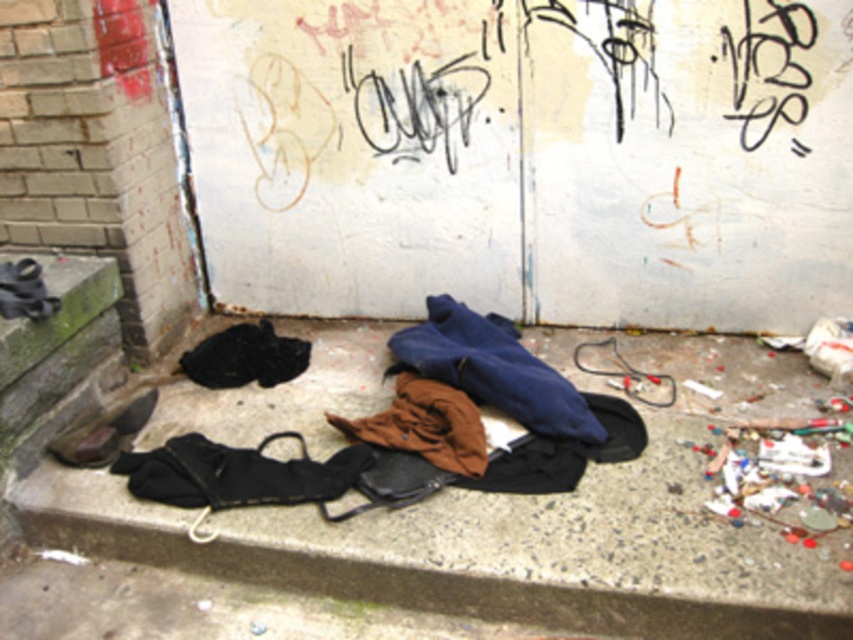
You are standing in the alley and want to pick up two items. One is at point [399,330] and the other at point [120,449]. Which item should you reach for first to minimize walking distance?

You should reach for the item at point [399,330] first because it is closer to you than the item at point [120,449].

You are standing in the middle of the scene. There is a point at coordinates (492, 369). Which object is this point located on?

The point at coordinates (492, 369) is located on the blue cotton hoodie at center.

You are a street cleaner assigned to pick up the blue cotton hoodie at center and the leather shoe at lower left. Which item requires a larger trash bag to fit without folding? Please explain your reasoning based on their sizes.

The blue cotton hoodie at center requires a larger trash bag because its width surpasses that of the leather shoe at lower left, as stated in the objects description.